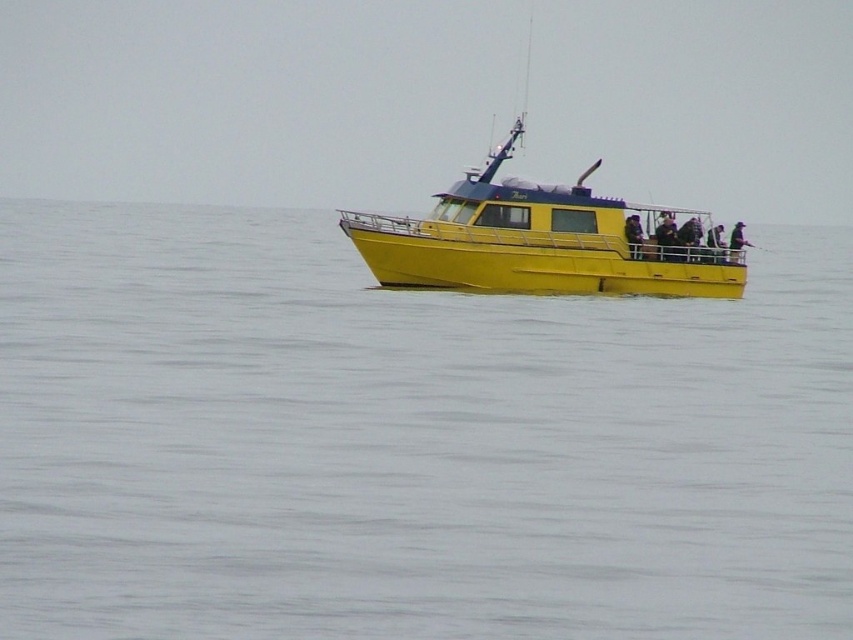
You are a photographer on the boat and want to take a photo of two specific points marked on the boat. The points are labeled as point 1 at coordinates point (70, 321) and point 2 at coordinates point (606, 269). You need to adjust your camera focus so that both points are in clear view. Which point should you focus on first to ensure both are in focus?

You should focus on point (70, 321) first because it is closer to the viewer than point (606, 269). By focusing on the closer point, the farther point will also be in focus due to the depth of field.

You are standing on the dock and see the yellow matte boat at center and the matte black jacket at upper right. Which object is closer to the left side of the image?

The yellow matte boat at center is to the left of the matte black jacket at upper right, so it is closer to the left side of the image.

You are a passenger on a boat trip and want to locate the yellow matte boat at center. Based on the coordinates provided, can you confirm if the point at (543, 241) is the correct location of the boat?

Yes, the point at (543, 241) marks the yellow matte boat at center, so it is the correct location.